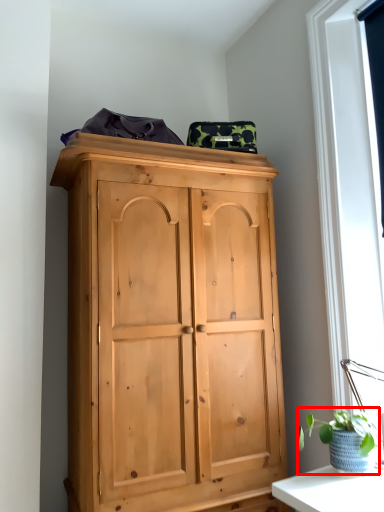
Question: From the image's perspective, what is the correct spatial positioning of houseplant (annotated by the red box) in reference to window screen?

Choices:
 (A) below
 (B) above

Answer: (A)